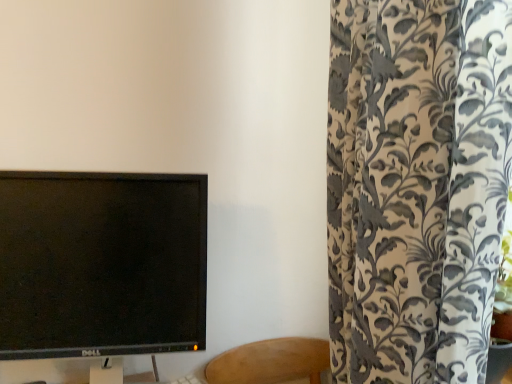
Question: Should I look upward or downward to see black glossy monitor at left?

Choices:
 (A) down
 (B) up

Answer: (A)